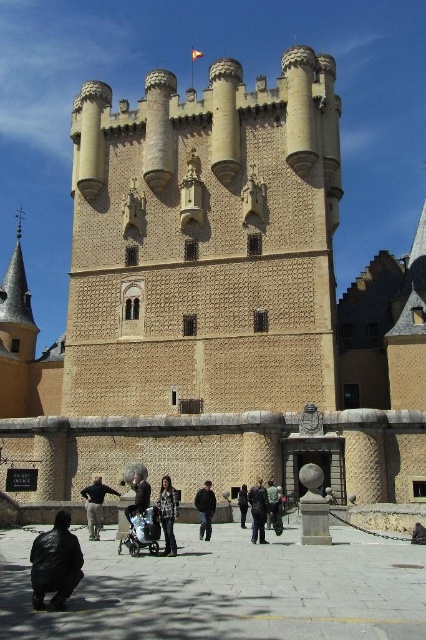
Can you confirm if black leather jacket at center is positioned below dark green fabric jacket at center?

No.

Can you confirm if black leather jacket at center is positioned to the right of dark green fabric jacket at center?

In fact, black leather jacket at center is to the left of dark green fabric jacket at center.

Image resolution: width=426 pixels, height=640 pixels. Find the location of `black leather jacket at center`. black leather jacket at center is located at coordinates (204, 509).

Can you confirm if black leather jacket at center is bigger than dark brown leather jacket at center?

Actually, black leather jacket at center might be smaller than dark brown leather jacket at center.

Is black leather jacket at center positioned in front of dark brown leather jacket at center?

No, black leather jacket at center is further to the viewer.

Who is more distant from viewer, (x=199, y=531) or (x=138, y=512)?

The point (x=199, y=531) is more distant.

Find the location of a particular element. Image resolution: width=426 pixels, height=640 pixels. black leather jacket at center is located at coordinates (204, 509).

Can you confirm if dark brown leather jacket at lower left is positioned above dark blue jeans at center?

Yes, dark brown leather jacket at lower left is above dark blue jeans at center.

Which is below, dark brown leather jacket at lower left or dark blue jeans at center?

dark blue jeans at center is lower down.

Between point (92, 515) and point (262, 508), which one is positioned in front?

Point (262, 508)

Identify the location of dark brown leather jacket at lower left. (95, 504).